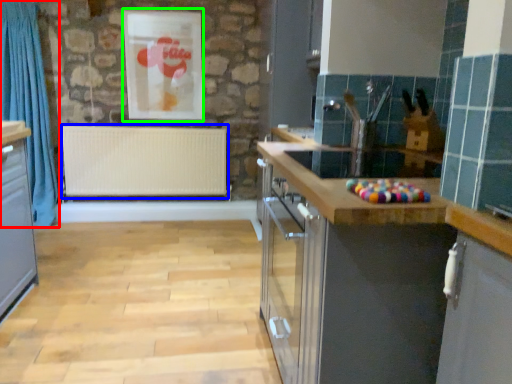
Question: Which is nearer to the curtain (highlighted by a red box)? radiator (highlighted by a blue box) or picture frame (highlighted by a green box).

Choices:
 (A) radiator
 (B) picture frame

Answer: (A)